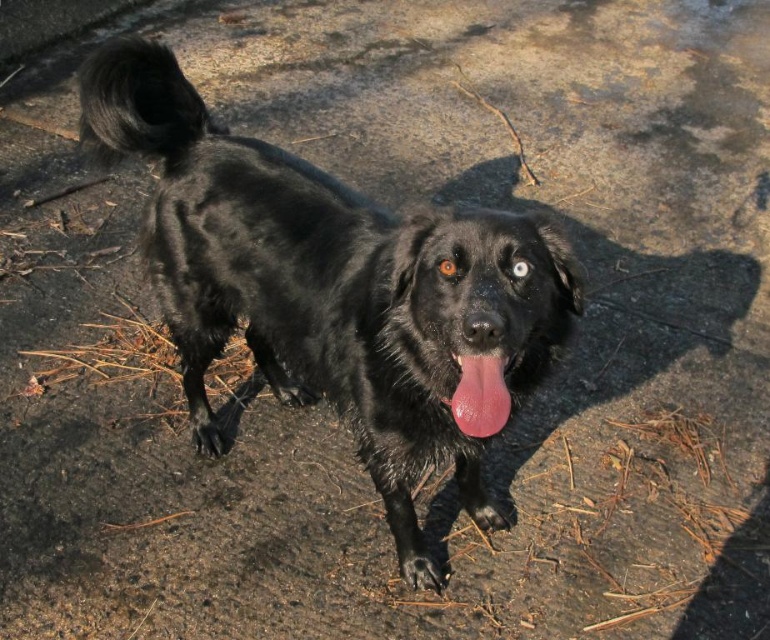
Question: Observing the image, what is the correct spatial positioning of shiny black dog at center in reference to pink glossy tongue at center?

Choices:
 (A) below
 (B) above

Answer: (B)

Question: Is shiny black dog at center further to camera compared to pink glossy tongue at center?

Choices:
 (A) yes
 (B) no

Answer: (B)

Question: Among these objects, which one is nearest to the camera?

Choices:
 (A) shiny black dog at center
 (B) pink glossy tongue at center

Answer: (A)

Question: Which point is farther from the camera taking this photo?

Choices:
 (A) (454, 397)
 (B) (407, 296)

Answer: (B)

Question: In this image, where is shiny black dog at center located relative to pink glossy tongue at center?

Choices:
 (A) above
 (B) below

Answer: (A)

Question: Which point is closer to the camera?

Choices:
 (A) (469, 369)
 (B) (320, 372)

Answer: (A)